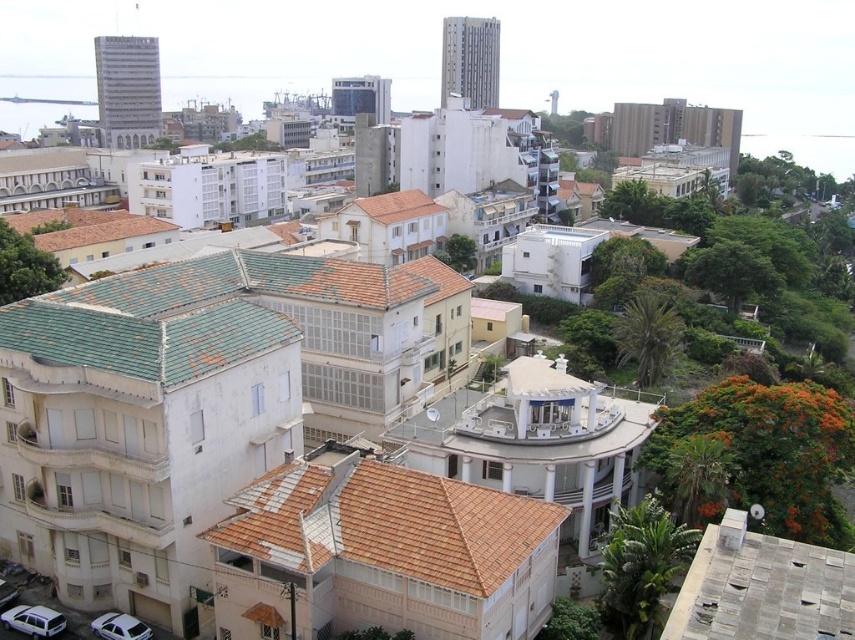
Question: Which point appears farthest from the camera in this image?

Choices:
 (A) (115, 636)
 (B) (21, 630)

Answer: (B)

Question: Is white matte station wagon at lower left wider than white glossy car at lower left?

Choices:
 (A) yes
 (B) no

Answer: (A)

Question: Considering the relative positions of white matte station wagon at lower left and white glossy car at lower left in the image provided, where is white matte station wagon at lower left located with respect to white glossy car at lower left?

Choices:
 (A) left
 (B) right

Answer: (A)

Question: Is white matte station wagon at lower left positioned at the back of white glossy car at lower left?

Choices:
 (A) yes
 (B) no

Answer: (A)

Question: Which object is closer to the camera taking this photo?

Choices:
 (A) white glossy car at lower left
 (B) white matte station wagon at lower left

Answer: (A)